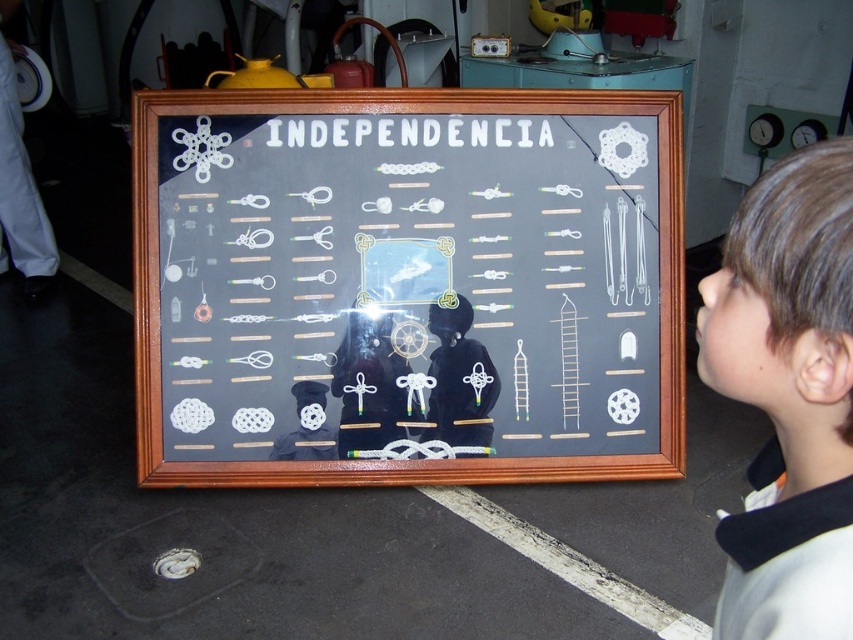
Which is in front, point (264, 428) or point (834, 189)?

Point (834, 189) is in front.

Between white paper at center and brown hair at upper right, which one has less height?

brown hair at upper right is shorter.

Who is more distant from viewer, (218, 282) or (833, 248)?

Point (218, 282)

What are the coordinates of `white paper at center` in the screenshot? It's located at (407, 285).